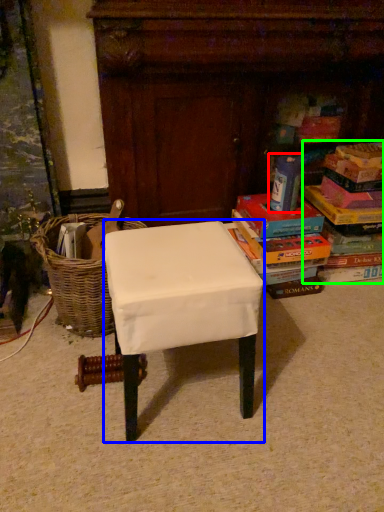
Question: Based on their relative distances, which object is farther from paperback book (highlighted by a red box)? Choose from stool (highlighted by a blue box) and book (highlighted by a green box).

Choices:
 (A) stool
 (B) book

Answer: (A)